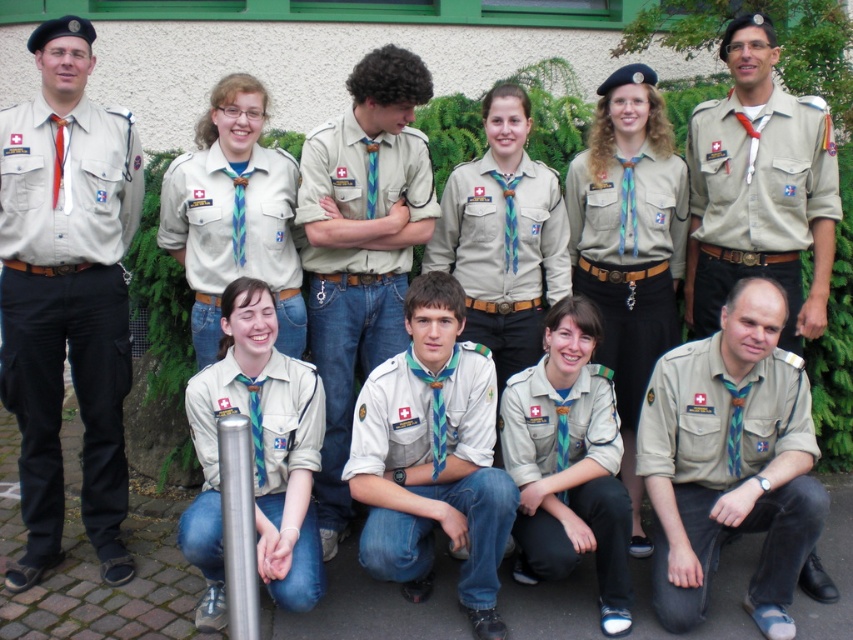
Question: Which object is farther from the camera taking this photo?

Choices:
 (A) matte khaki shirt at left
 (B) matte khaki shirt at lower center
 (C) light beige uniform at center

Answer: (A)

Question: Can you confirm if matte khaki shirt at left is wider than matte khaki uniform at center?

Choices:
 (A) no
 (B) yes

Answer: (B)

Question: Which object appears farthest from the camera in this image?

Choices:
 (A) beige fabric uniform at upper center
 (B) matte khaki uniform at center

Answer: (B)

Question: Which of the following is the farthest from the observer?

Choices:
 (A) click(260, 438)
 (B) click(296, 186)

Answer: (B)

Question: Does white cotton shirt at center have a smaller size compared to light beige uniform at center?

Choices:
 (A) yes
 (B) no

Answer: (A)

Question: Is beige fabric uniform at lower right bigger than light beige uniform at center?

Choices:
 (A) no
 (B) yes

Answer: (A)